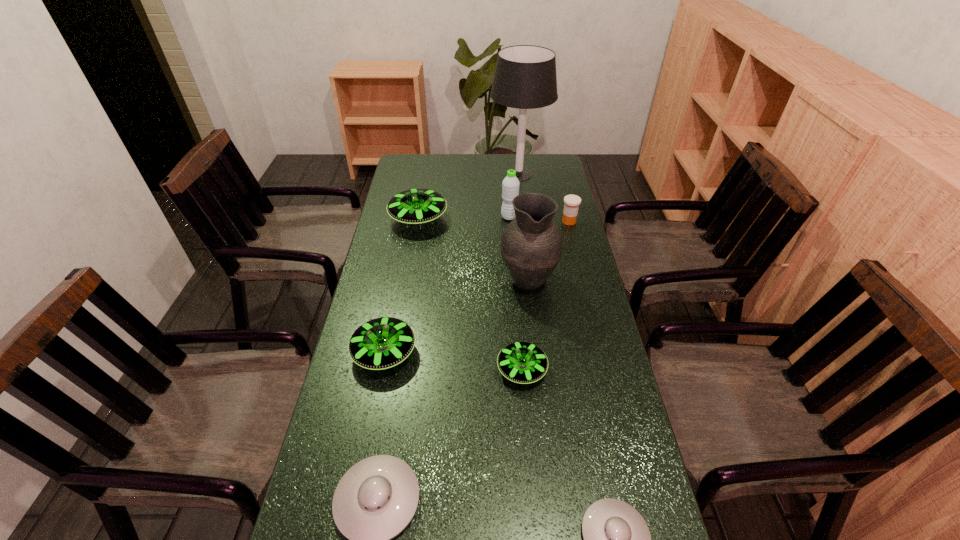
Identify the location of free spot located 0.320m on the left of the rightmost green saucer. This screenshot has height=540, width=960. (378, 369).

The height and width of the screenshot is (540, 960). Identify the location of object that is at the far edge. (525, 77).

I want to click on table lamp present at the right edge, so click(525, 77).

The image size is (960, 540). What are the coordinates of `pitcher located at the right edge` in the screenshot? It's located at (531, 245).

Identify the location of medicine at the right edge. (571, 202).

At what (x,y) coordinates should I click in order to perform the action: click on object that is positioned at the far right corner. Please return your answer as a coordinate pair (x, y). Image resolution: width=960 pixels, height=540 pixels. Looking at the image, I should click on (525, 77).

The width and height of the screenshot is (960, 540). In the image, there is a desktop. Identify the location of free space at the left edge. (398, 288).

At what (x,y) coordinates should I click in order to perform the action: click on vacant space at the right edge. Please return your answer as a coordinate pair (x, y). This screenshot has height=540, width=960. Looking at the image, I should click on (556, 188).

This screenshot has height=540, width=960. I want to click on free space at the far left corner, so click(429, 165).

Find the location of `free spot between the fifth farthest object and the second biggest green saucer`. free spot between the fifth farthest object and the second biggest green saucer is located at coordinates 456,315.